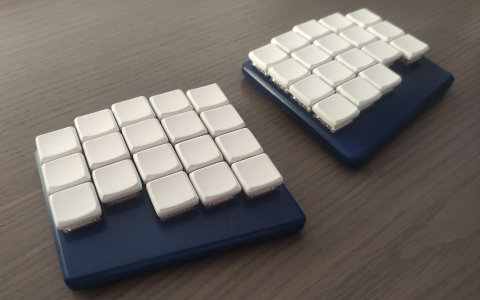
The width and height of the screenshot is (480, 300). What are the coordinates of `table` in the screenshot? It's located at (404, 248).